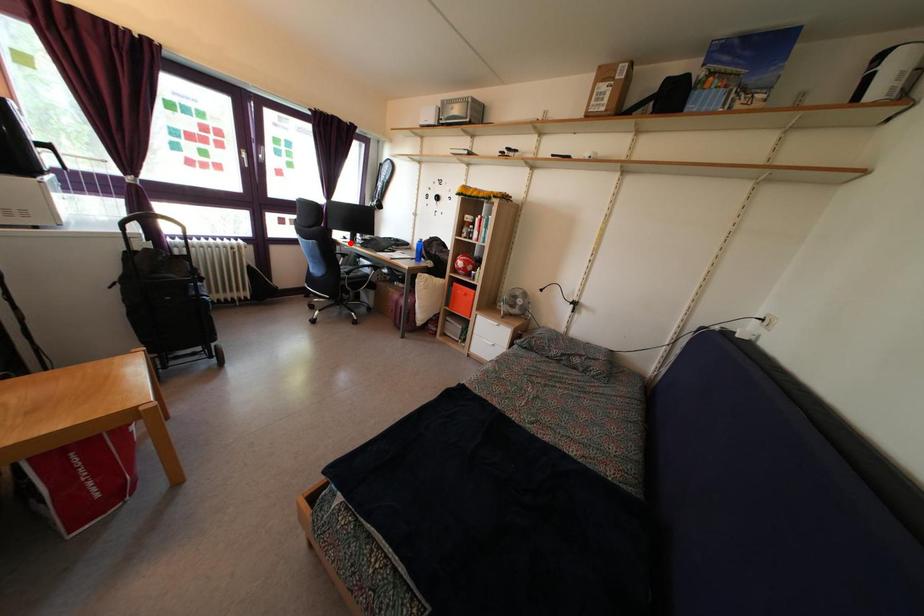
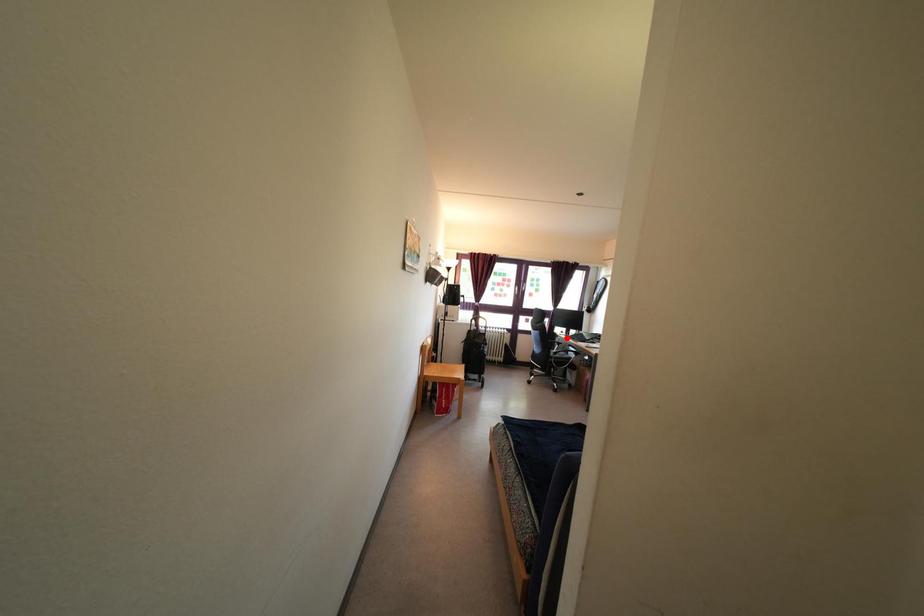
I am providing you with two images of the same scene from different viewpoints. A red point is marked on the first image and another point is marked on the second image. Do the highlighted points in image1 and image2 indicate the same real-world spot?

Yes